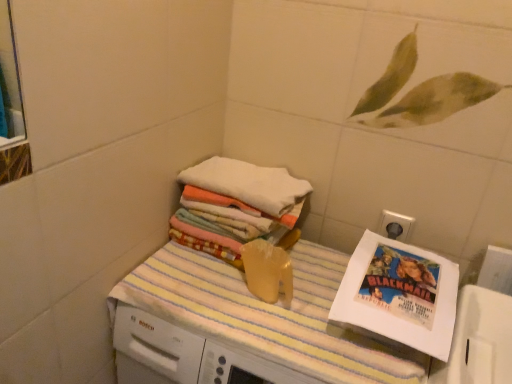
Where is `vacant region above white paper comic book at right (from a real-world perspective)`? The width and height of the screenshot is (512, 384). vacant region above white paper comic book at right (from a real-world perspective) is located at coordinates (407, 268).